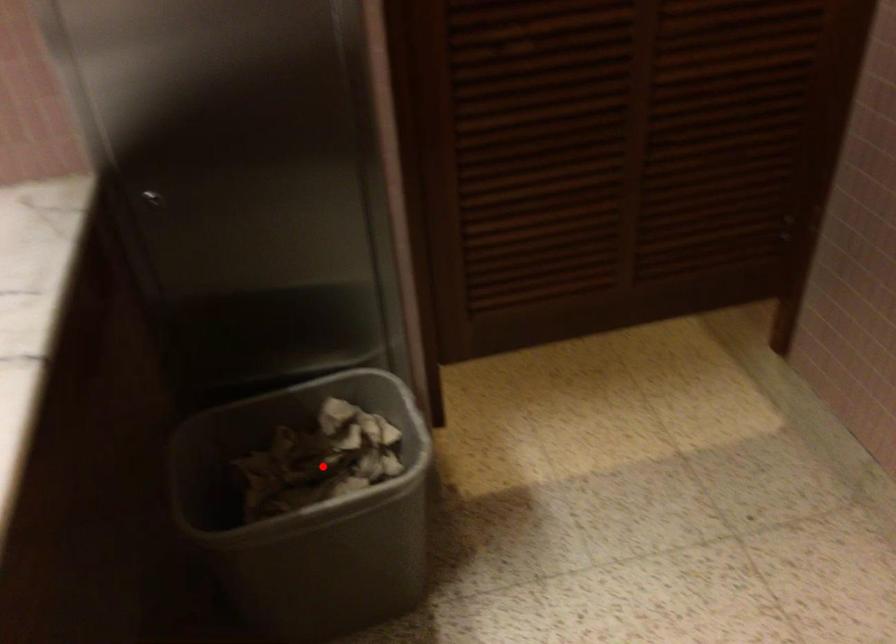
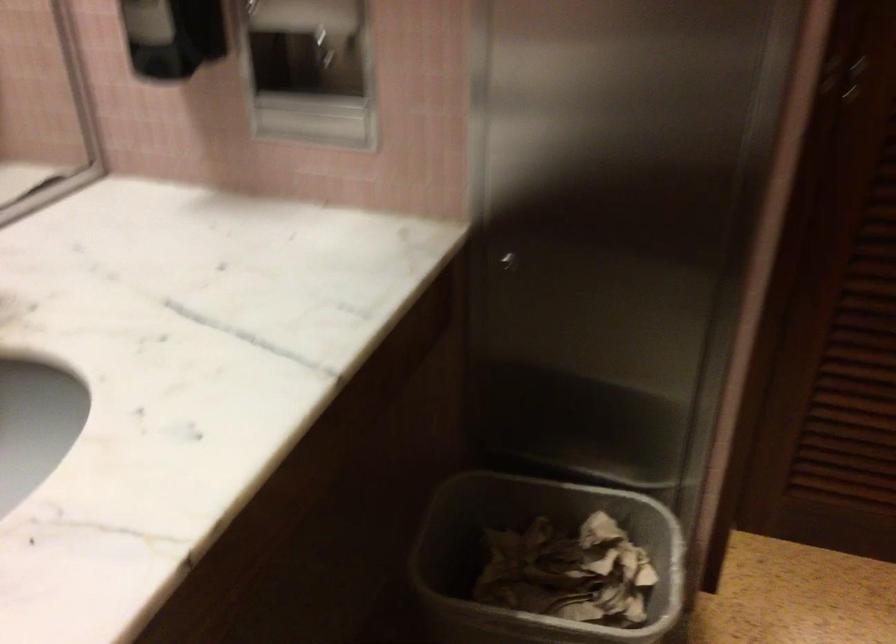
Where in the second image is the point corresponding to the highlighted location from the first image?

(567, 572)